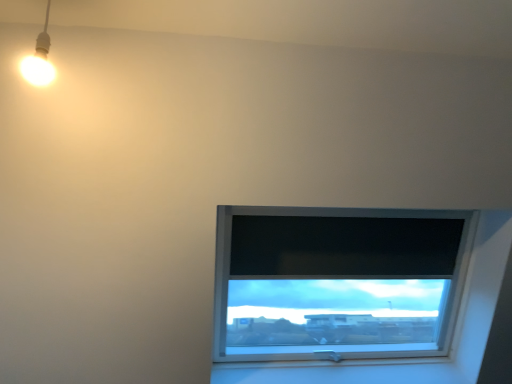
Describe the element at coordinates (39, 59) in the screenshot. The image size is (512, 384). I see `matte white bulb at upper left` at that location.

The height and width of the screenshot is (384, 512). In order to click on matte white bulb at upper left in this screenshot , I will do `click(39, 59)`.

Identify the location of matte white bulb at upper left. Image resolution: width=512 pixels, height=384 pixels. (39, 59).